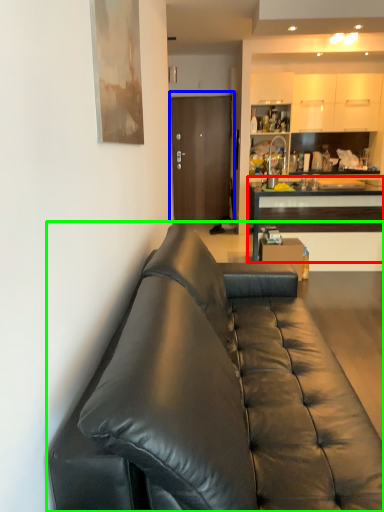
Question: Considering the real-world distances, which object is farthest from cabinetry (highlighted by a red box)? door (highlighted by a blue box) or studio couch (highlighted by a green box)?

Choices:
 (A) door
 (B) studio couch

Answer: (B)